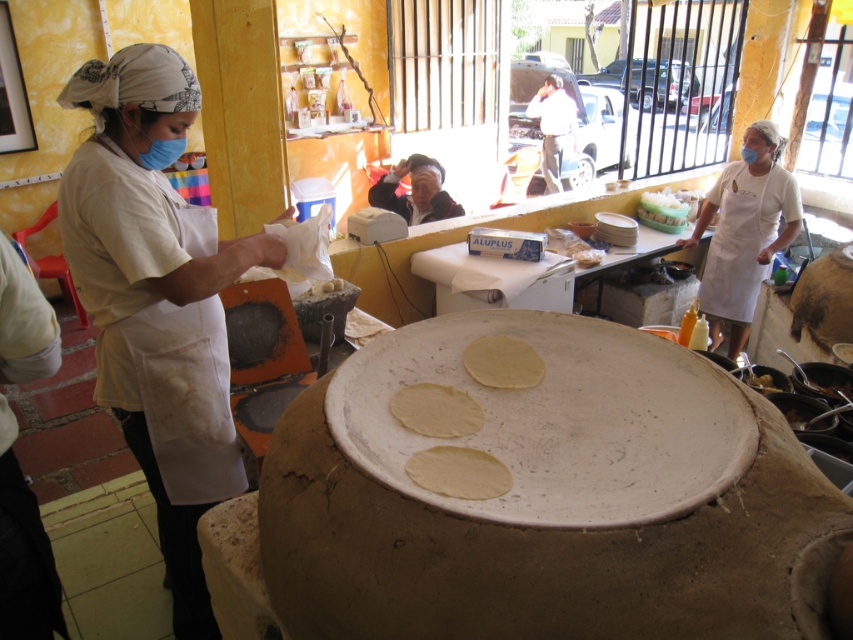
Question: Is white matte apron at left above light brown dough at center?

Choices:
 (A) yes
 (B) no

Answer: (A)

Question: Can you confirm if white dough at center is positioned to the left of yellow matte tortilla at center?

Choices:
 (A) yes
 (B) no

Answer: (A)

Question: Which point is closer to the camera?

Choices:
 (A) (172, 468)
 (B) (432, 465)

Answer: (B)

Question: Based on their relative distances, which object is farther from the white glossy tortillas at center?

Choices:
 (A) light brown dough at center
 (B) white matte apron at left
 (C) yellow matte tortilla at center
 (D) white dough at center

Answer: (D)

Question: Is white apron at right smaller than white dough at center?

Choices:
 (A) yes
 (B) no

Answer: (B)

Question: Which point is farther from the camera taking this photo?

Choices:
 (A) (190, 216)
 (B) (712, 288)
 (C) (643, 195)

Answer: (C)